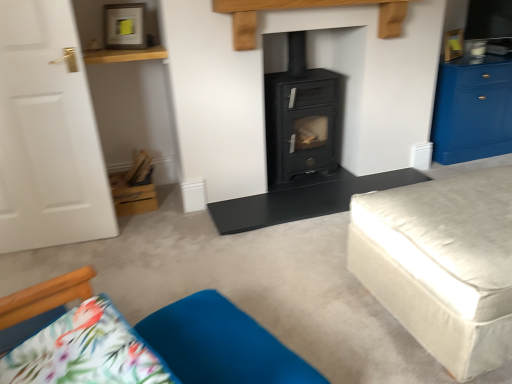
Question: Considering the relative sizes of blue glossy cabinet at right and black matte wood burning stove at center in the image provided, is blue glossy cabinet at right thinner than black matte wood burning stove at center?

Choices:
 (A) no
 (B) yes

Answer: (A)

Question: Is blue glossy cabinet at right facing towards black matte wood burning stove at center?

Choices:
 (A) no
 (B) yes

Answer: (A)

Question: Is blue glossy cabinet at right closer to the viewer compared to black matte wood burning stove at center?

Choices:
 (A) yes
 (B) no

Answer: (B)

Question: Can you confirm if blue glossy cabinet at right is positioned to the left of black matte wood burning stove at center?

Choices:
 (A) yes
 (B) no

Answer: (B)

Question: Is blue glossy cabinet at right not inside black matte wood burning stove at center?

Choices:
 (A) yes
 (B) no

Answer: (A)

Question: Considering the positions of point (216, 306) and point (24, 140), is point (216, 306) closer or farther from the camera than point (24, 140)?

Choices:
 (A) closer
 (B) farther

Answer: (A)

Question: Based on their sizes in the image, would you say velvety blue cushion at lower center is bigger or smaller than white matte door at left?

Choices:
 (A) small
 (B) big

Answer: (A)

Question: From a real-world perspective, is velvety blue cushion at lower center above or below white matte door at left?

Choices:
 (A) above
 (B) below

Answer: (B)

Question: Visually, is velvety blue cushion at lower center positioned to the left or to the right of white matte door at left?

Choices:
 (A) right
 (B) left

Answer: (A)

Question: Based on their positions, is blue glossy cabinet at right located to the left or right of beige fabric ottoman at right?

Choices:
 (A) right
 (B) left

Answer: (A)

Question: Choose the correct answer: Is blue glossy cabinet at right inside beige fabric ottoman at right or outside it?

Choices:
 (A) outside
 (B) inside

Answer: (A)

Question: Looking at their shapes, would you say blue glossy cabinet at right is wider or thinner than beige fabric ottoman at right?

Choices:
 (A) wide
 (B) thin

Answer: (B)

Question: Does point (446, 119) appear closer or farther from the camera than point (480, 279)?

Choices:
 (A) closer
 (B) farther

Answer: (B)

Question: Based on their positions, is beige fabric ottoman at right located to the left or right of black matte table at center?

Choices:
 (A) left
 (B) right

Answer: (B)

Question: From a real-world perspective, is beige fabric ottoman at right above or below black matte table at center?

Choices:
 (A) below
 (B) above

Answer: (B)